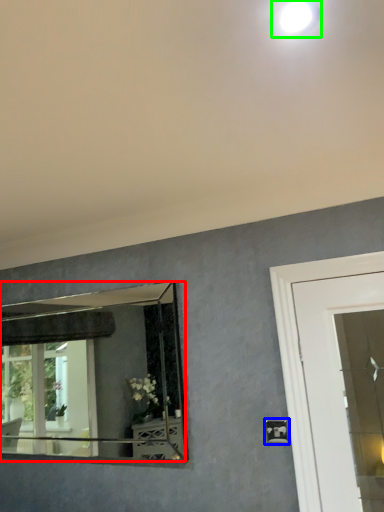
Question: Estimate the real-world distances between objects in this image. Which object is closer to mirror (highlighted by a red box), light switch (highlighted by a blue box) or droplight (highlighted by a green box)?

Choices:
 (A) light switch
 (B) droplight

Answer: (A)